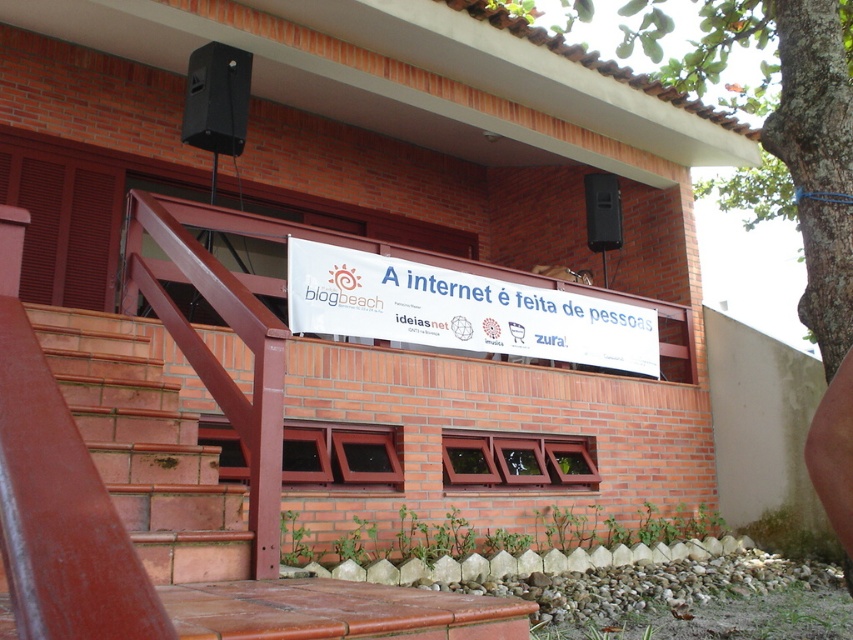
Question: Can you confirm if white paper banner at upper center is smaller than black plastic speaker at upper center?

Choices:
 (A) no
 (B) yes

Answer: (A)

Question: Which of the following is the farthest from the observer?

Choices:
 (A) (607, 220)
 (B) (453, 296)
 (C) (96, 454)

Answer: (A)

Question: Considering the real-world distances, which object is farthest from the black plastic speaker at upper center?

Choices:
 (A) black matte speaker at upper center
 (B) terracotta brick stairs at lower left

Answer: (B)

Question: Is black matte speaker at upper center wider than black plastic speaker at upper center?

Choices:
 (A) yes
 (B) no

Answer: (A)

Question: Where is terracotta brick stairs at lower left located in relation to black plastic speaker at upper center in the image?

Choices:
 (A) left
 (B) right

Answer: (A)

Question: Estimate the real-world distances between objects in this image. Which object is farther from the white paper banner at upper center?

Choices:
 (A) black matte speaker at upper center
 (B) terracotta brick stairs at lower left

Answer: (B)